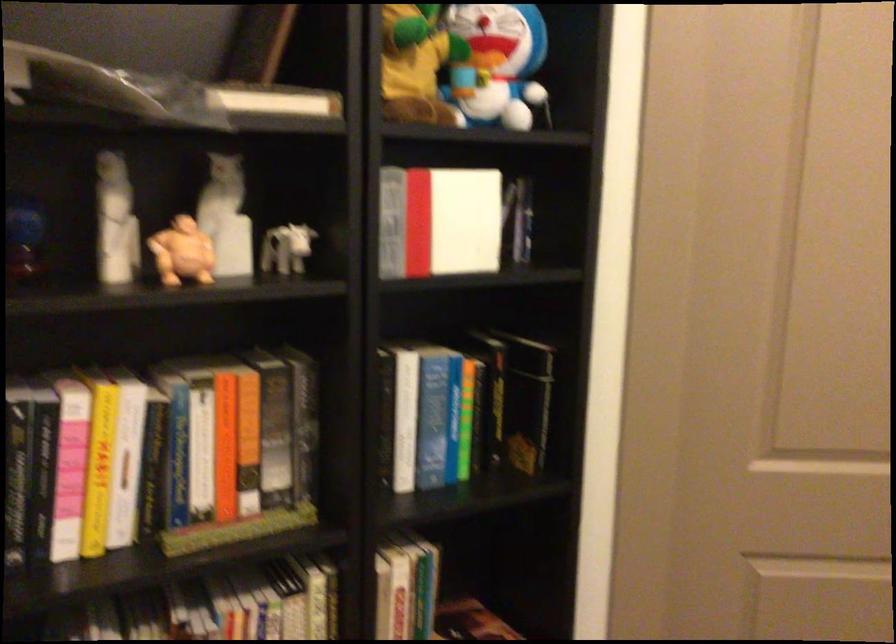
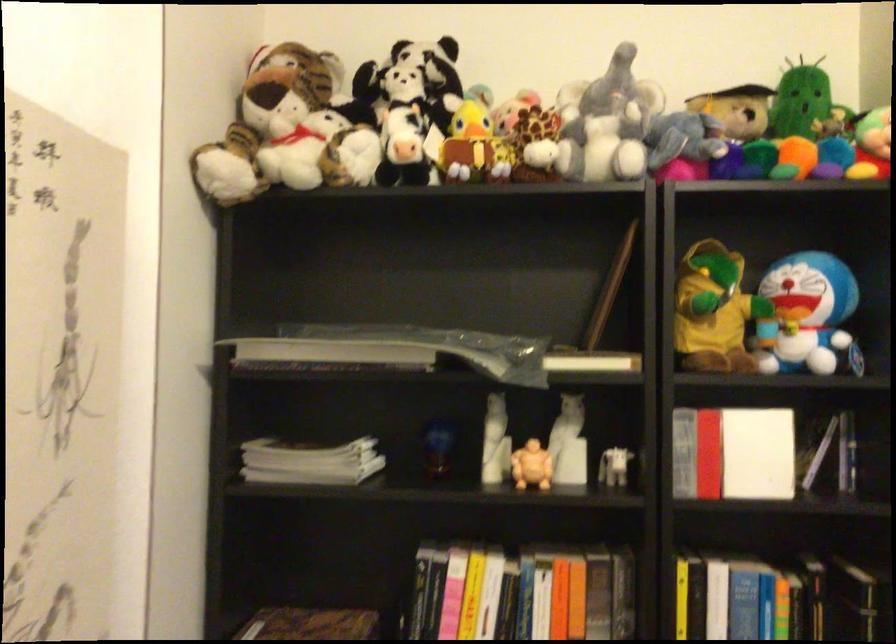
In the second image, find the point that corresponds to point 467,381 in the first image.

(780, 599)